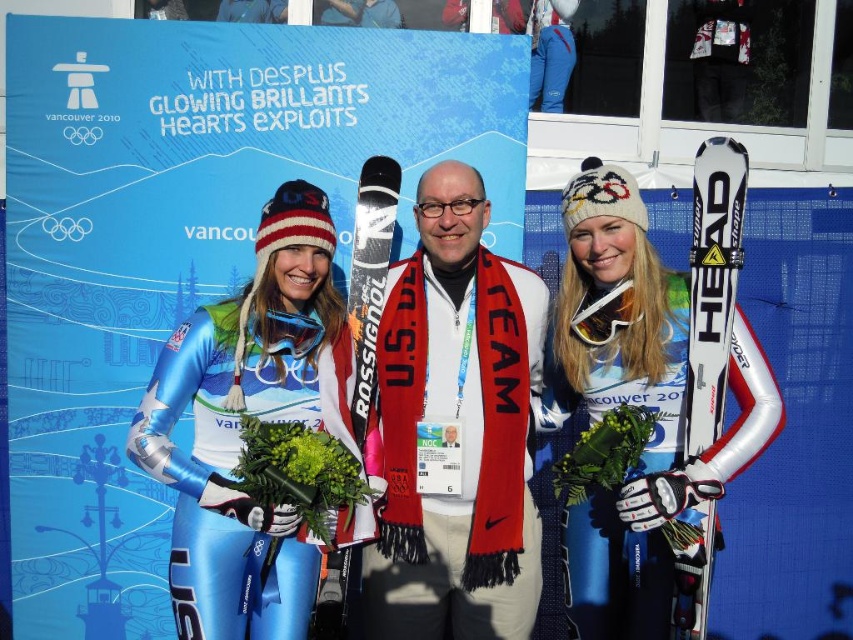
Who is higher up, blue metallic ski suit at left or white matte ski at right?

Positioned higher is white matte ski at right.

How far apart are blue metallic ski suit at left and white matte ski at right?

A distance of 5.79 feet exists between blue metallic ski suit at left and white matte ski at right.

This screenshot has width=853, height=640. Describe the element at coordinates (239, 426) in the screenshot. I see `blue metallic ski suit at left` at that location.

This screenshot has width=853, height=640. I want to click on blue metallic ski suit at left, so click(239, 426).

Does metallic blue ski suit at center have a greater width compared to white matte scarf at center?

Yes, metallic blue ski suit at center is wider than white matte scarf at center.

Does metallic blue ski suit at center have a smaller size compared to white matte scarf at center?

No.

You are a GUI agent. You are given a task and a screenshot of the screen. Output one action in this format:
    pyautogui.click(x=<x>, y=<y>)
    Task: Click on the metallic blue ski suit at center
    
    Given the screenshot: What is the action you would take?
    pyautogui.click(x=368, y=413)

Is white matte ski at center wider than black matte ski at center?

Indeed, white matte ski at center has a greater width compared to black matte ski at center.

Is white matte ski at center above black matte ski at center?

Actually, white matte ski at center is below black matte ski at center.

Between point (599, 284) and point (386, 205), which one is positioned in front?

Point (599, 284) is more forward.

The height and width of the screenshot is (640, 853). Find the location of `white matte ski at center`. white matte ski at center is located at coordinates (636, 403).